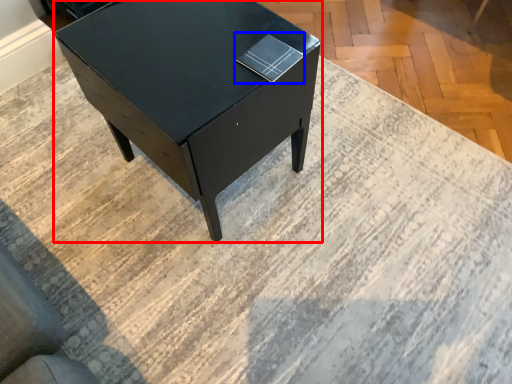
Question: Which object appears closest to the camera in this image, table (highlighted by a red box) or book (highlighted by a blue box)?

Choices:
 (A) table
 (B) book

Answer: (A)